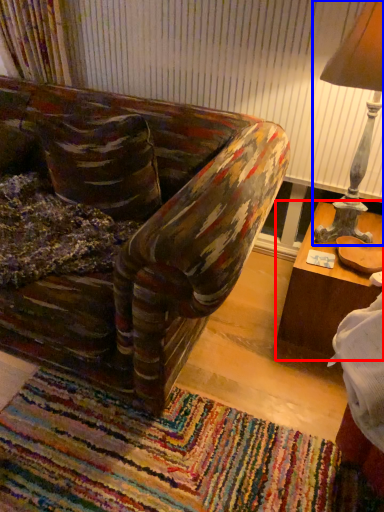
Question: Which point is further to the camera, table (highlighted by a red box) or table lamp (highlighted by a blue box)?

Choices:
 (A) table
 (B) table lamp

Answer: (A)